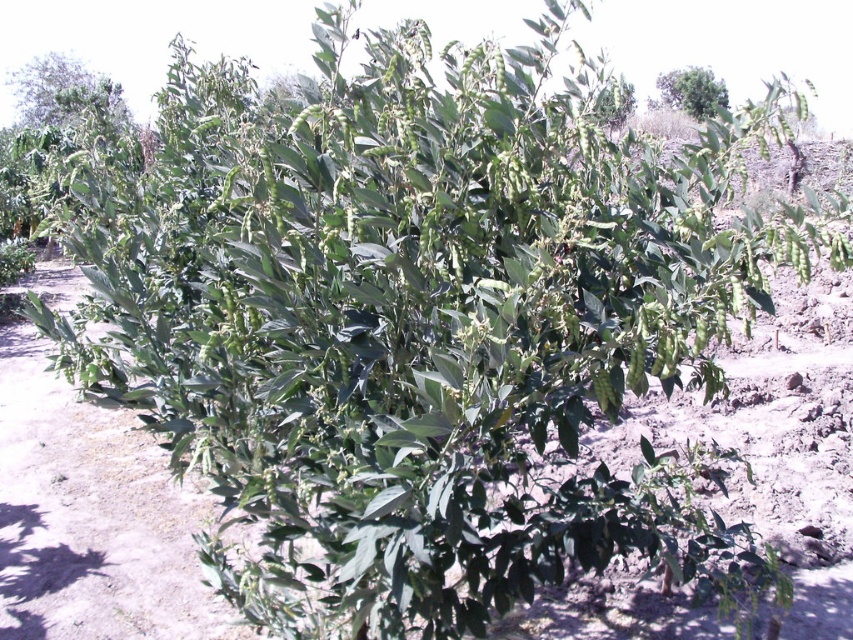
Which is more to the right, green leafy plant at upper left or green leafy tree at upper center?

Positioned to the right is green leafy tree at upper center.

Between green leafy plant at upper left and green leafy tree at upper center, which one has more height?

green leafy tree at upper center is taller.

Image resolution: width=853 pixels, height=640 pixels. What are the coordinates of `green leafy plant at upper left` in the screenshot? It's located at (61, 90).